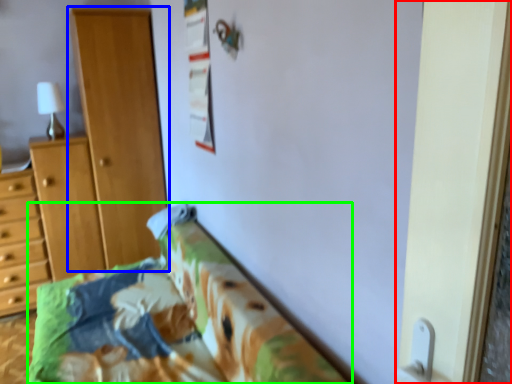
Question: Based on their relative distances, which object is farther from screen door (highlighted by a red box)? Choose from cupboard (highlighted by a blue box) and furniture (highlighted by a green box).

Choices:
 (A) cupboard
 (B) furniture

Answer: (A)